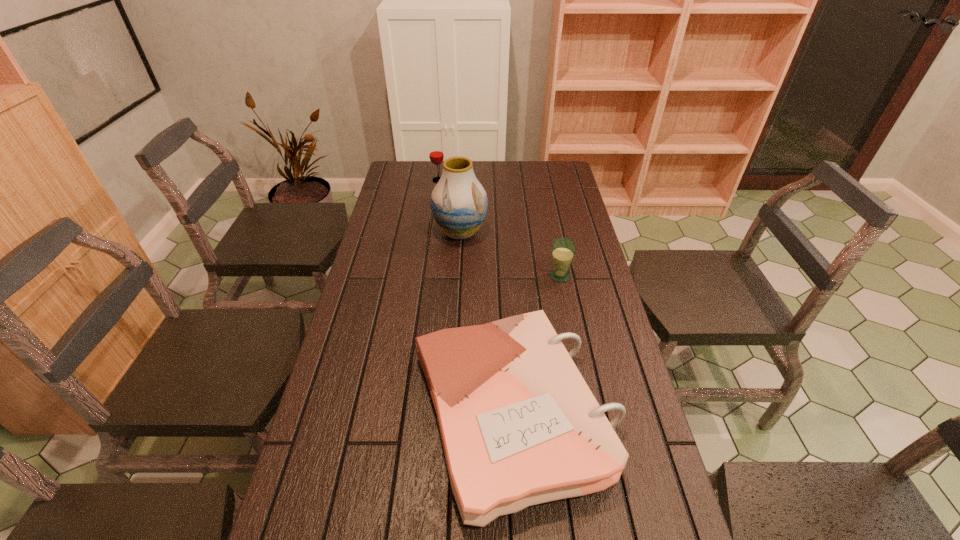
This screenshot has width=960, height=540. I want to click on unoccupied position between the farther glass and the nearest object, so click(x=476, y=296).

Locate an element on the screen. free space between the farther glass and the third farthest object is located at coordinates (499, 228).

Identify the location of vacant space that is in between the phonebook and the tallest object. The width and height of the screenshot is (960, 540). (487, 323).

Locate an element on the screen. The image size is (960, 540). vacant region between the left glass and the phonebook is located at coordinates (476, 296).

What are the coordinates of `free area in between the third farthest object and the farthest object` in the screenshot? It's located at (499, 228).

Locate which object ranks in proximity to the phonebook. Please provide its 2D coordinates. Your answer should be formatted as a tuple, i.e. [(x, y)], where the tuple contains the x and y coordinates of a point satisfying the conditions above.

[(563, 249)]

The image size is (960, 540). I want to click on object that is the third closest to the tallest object, so click(519, 425).

Where is `vacant space that satisfies the following two spatial constraints: 1. on the front side of the farthest object; 2. on the left side of the shorter glass`? The height and width of the screenshot is (540, 960). vacant space that satisfies the following two spatial constraints: 1. on the front side of the farthest object; 2. on the left side of the shorter glass is located at coordinates (425, 275).

Locate an element on the screen. Image resolution: width=960 pixels, height=540 pixels. vacant point that satisfies the following two spatial constraints: 1. on the front side of the nearer glass; 2. on the left side of the taller glass is located at coordinates (425, 275).

Identify the location of blank space that satisfies the following two spatial constraints: 1. on the front side of the vase; 2. on the right side of the taller glass. This screenshot has height=540, width=960. (431, 232).